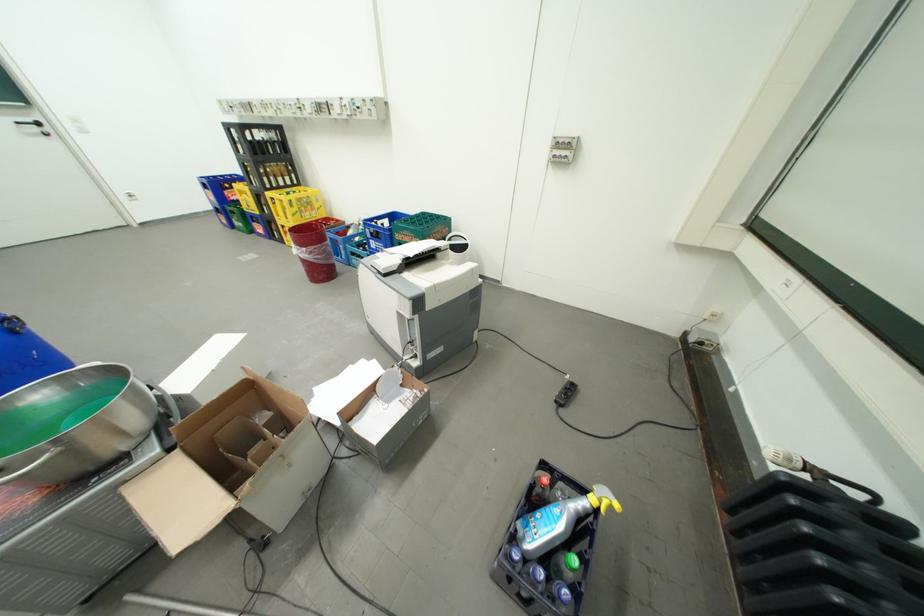
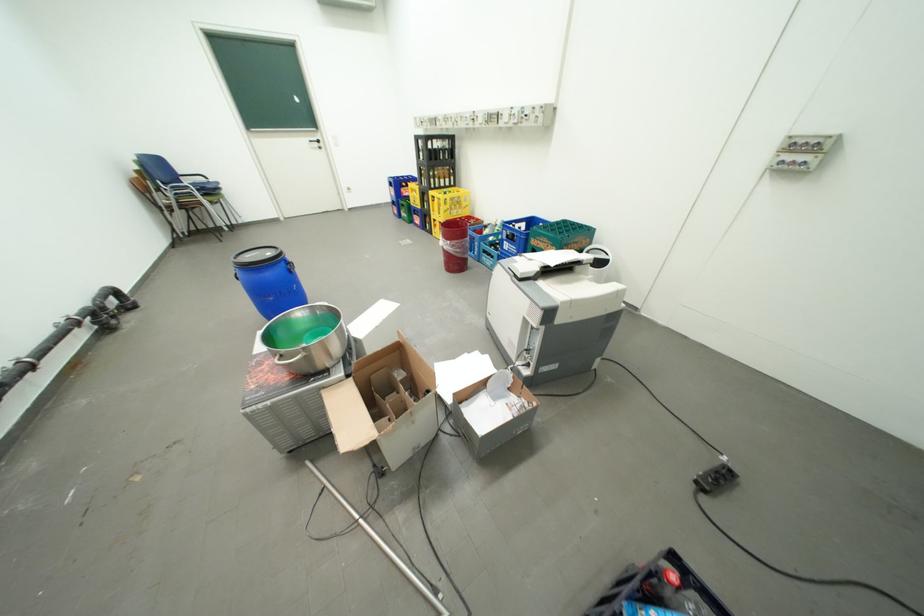
Question: The camera is either moving clockwise (left) or counter-clockwise (right) around the object. The first image is from the beginning of the video and the second image is from the end. Is the camera moving left or right when shooting the video?

Choices:
 (A) Left
 (B) Right

Answer: (B)